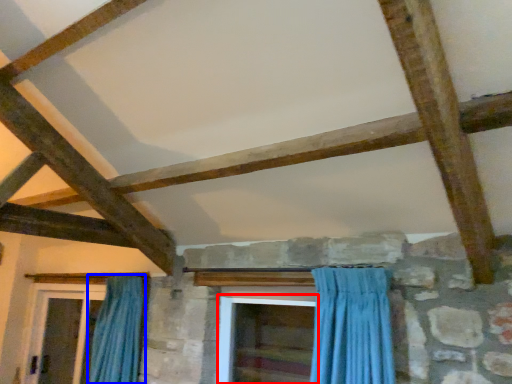
Question: Which of the following is the farthest to the observer, screen door (highlighted by a red box) or curtain (highlighted by a blue box)?

Choices:
 (A) screen door
 (B) curtain

Answer: (B)